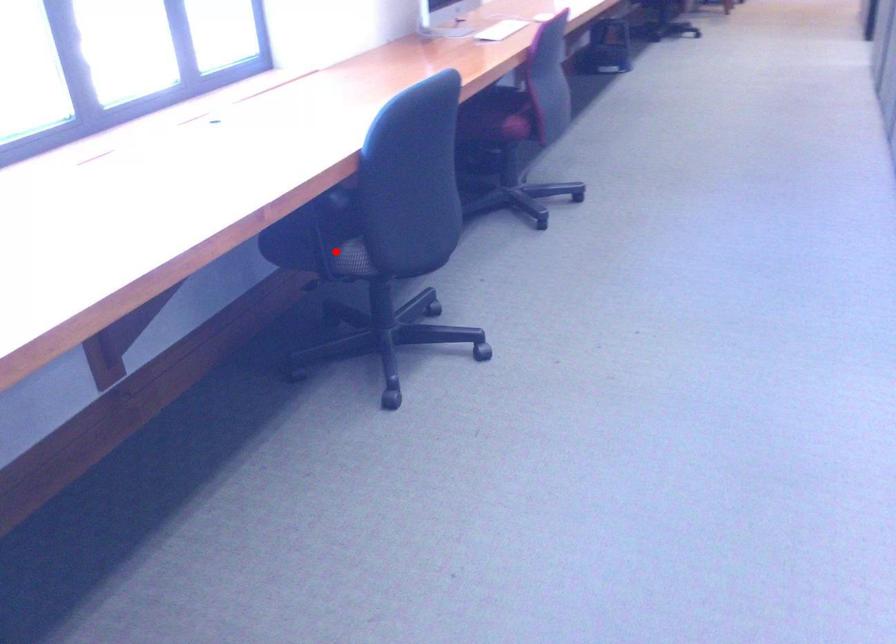
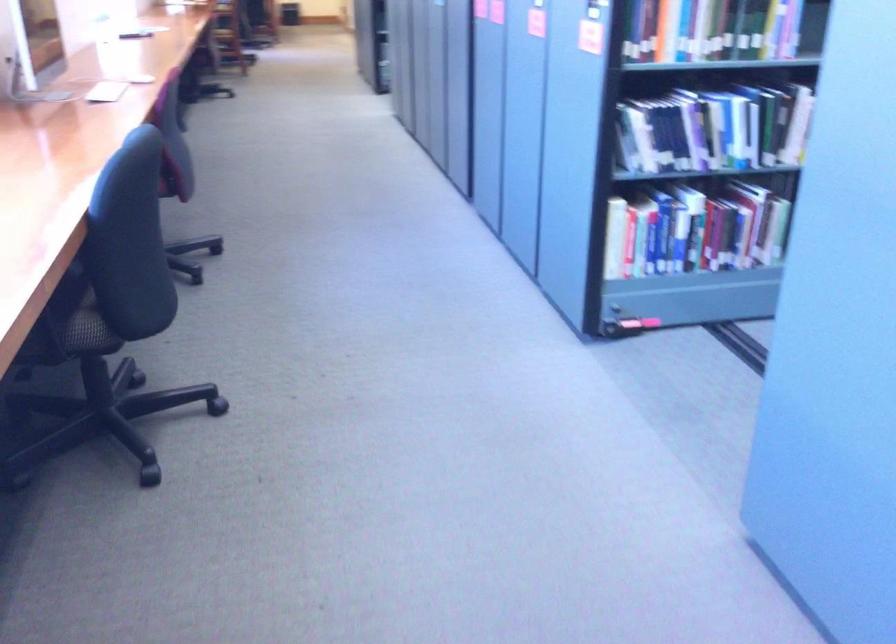
Locate, in the second image, the point that corresponds to the highlighted location in the first image.

(73, 324)